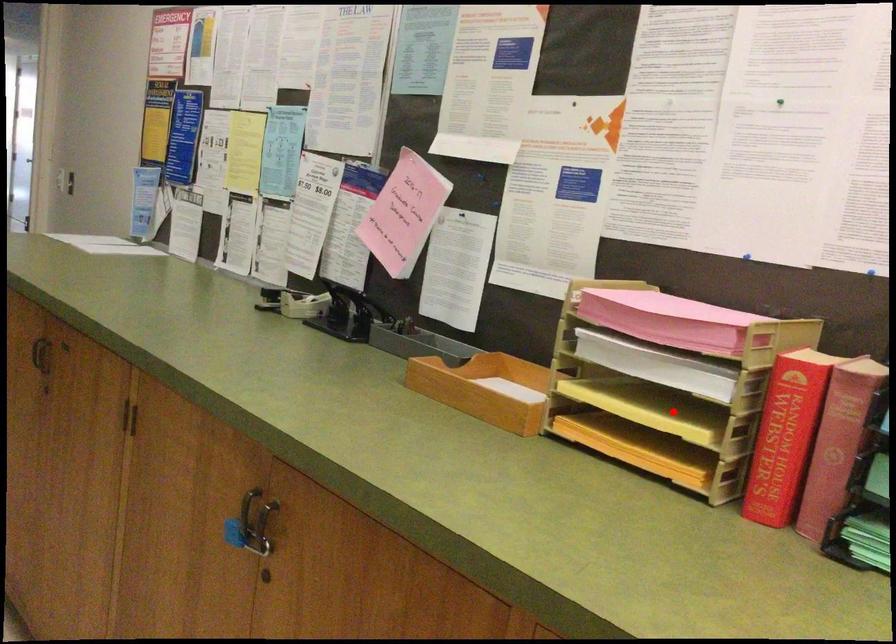
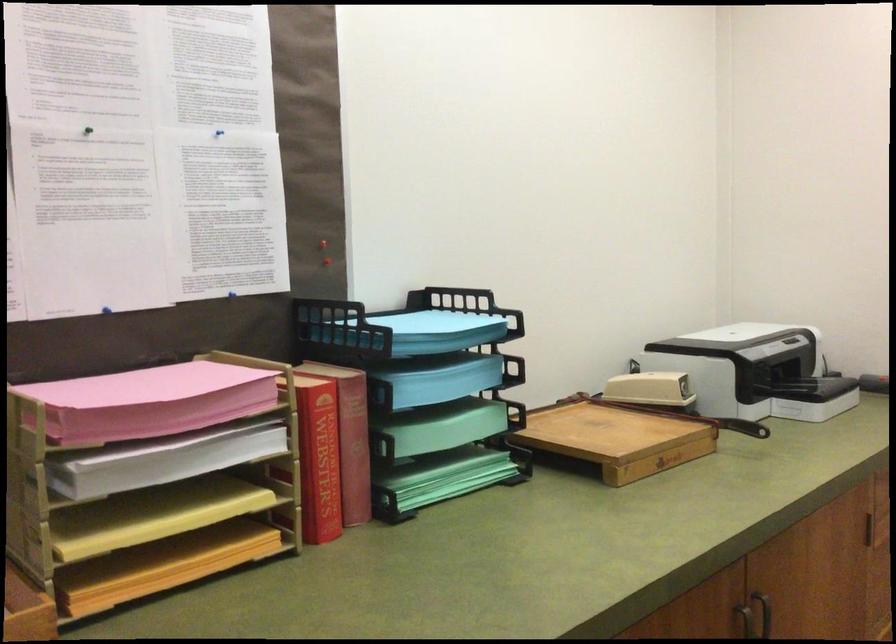
Find the pixel in the second image that matches the highlighted location in the first image.

(151, 515)